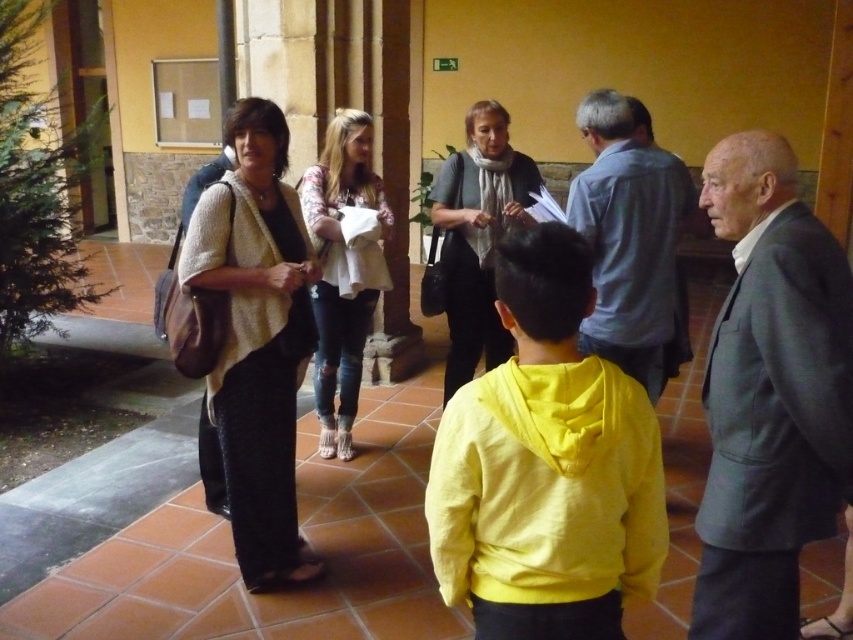
Question: Does gray wool suit at right lie in front of light blue shirt at center?

Choices:
 (A) yes
 (B) no

Answer: (A)

Question: Which of the following is the farthest from the observer?

Choices:
 (A) light blue shirt at center
 (B) gray wool suit at right

Answer: (A)

Question: Does gray wool suit at right have a smaller size compared to light blue shirt at center?

Choices:
 (A) yes
 (B) no

Answer: (A)

Question: Can you confirm if gray wool suit at right is positioned above light blue shirt at center?

Choices:
 (A) no
 (B) yes

Answer: (A)